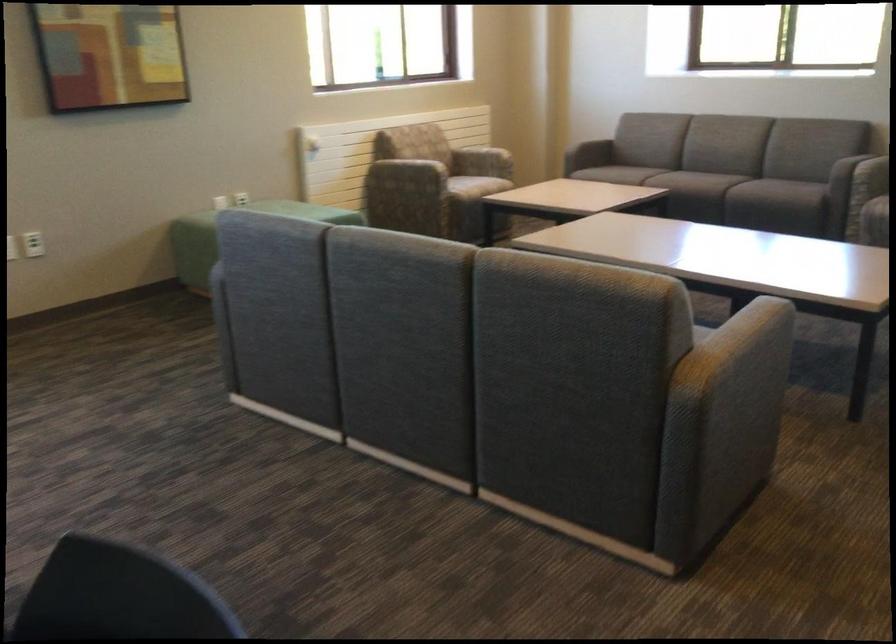
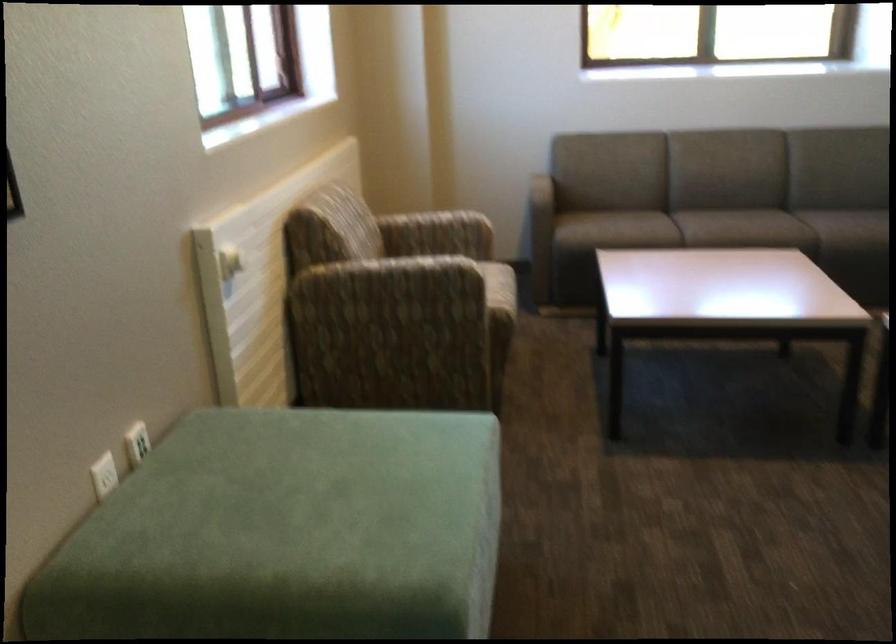
In the second image, find the point that corresponds to point 211,199 in the first image.

(104, 475)